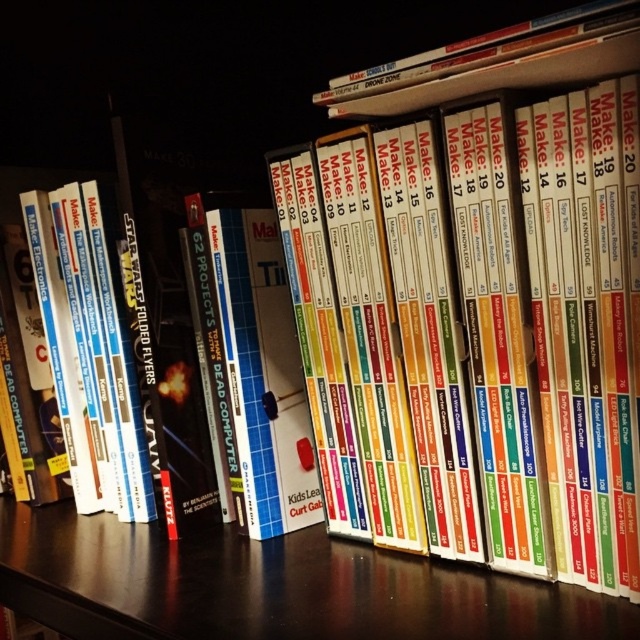
Question: Among these objects, which one is nearest to the camera?

Choices:
 (A) hardcover book at upper center
 (B) black wood table at center

Answer: (A)

Question: Which of the following is the farthest from the observer?

Choices:
 (A) black wood table at center
 (B) hardcover book at upper center

Answer: (A)

Question: Is black wood table at center wider than hardcover book at upper center?

Choices:
 (A) yes
 (B) no

Answer: (A)

Question: Which point is closer to the camera?

Choices:
 (A) (170, 554)
 (B) (445, 81)

Answer: (B)

Question: Does black wood table at center have a lesser width compared to hardcover book at upper center?

Choices:
 (A) yes
 (B) no

Answer: (B)

Question: Observing the image, what is the correct spatial positioning of black wood table at center in reference to hardcover book at upper center?

Choices:
 (A) right
 (B) left

Answer: (B)